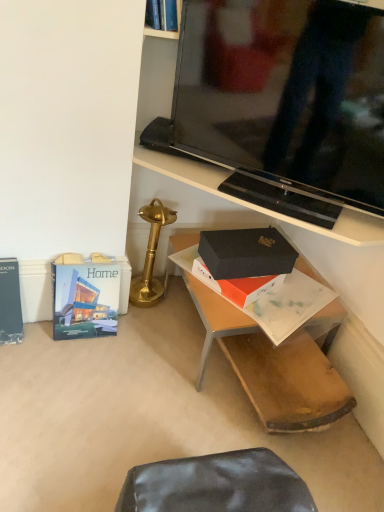
Locate an element on the screen. The height and width of the screenshot is (512, 384). free space in front of gold polished table lamp at center is located at coordinates [x=148, y=326].